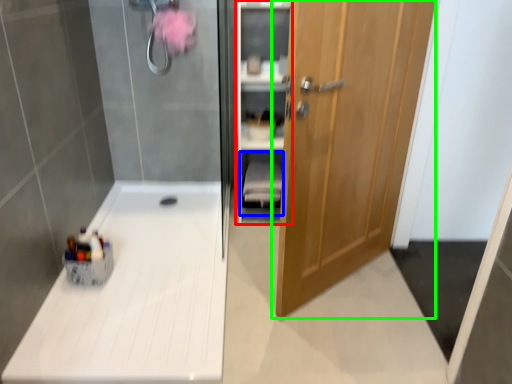
Question: Estimate the real-world distances between objects in this image. Which object is closer to cabinet (highlighted by a red box), shelf (highlighted by a blue box) or door (highlighted by a green box)?

Choices:
 (A) shelf
 (B) door

Answer: (A)